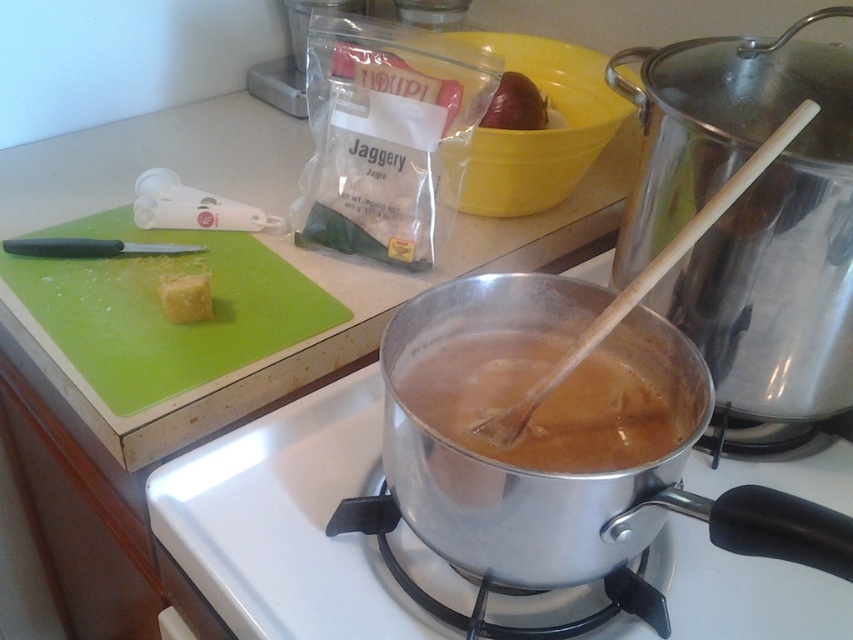
Question: Is silver metallic pot at center thinner than green cutting board at left?

Choices:
 (A) yes
 (B) no

Answer: (B)

Question: Does brown matte soup at center appear over red glossy apple at upper center?

Choices:
 (A) yes
 (B) no

Answer: (B)

Question: Which of these objects is positioned closest to the yellow butter at center?

Choices:
 (A) green cutting board at left
 (B) red glossy apple at upper center

Answer: (A)

Question: Which object appears closest to the camera in this image?

Choices:
 (A) wooden spoon at center
 (B) silver metallic pot at center

Answer: (A)

Question: Which point is farther to the camera?

Choices:
 (A) (196, 300)
 (B) (573, 445)
 (C) (213, 516)
 (D) (503, 419)

Answer: (A)

Question: Can you confirm if silver metallic pot at center is positioned below green cutting board at left?

Choices:
 (A) yes
 (B) no

Answer: (A)